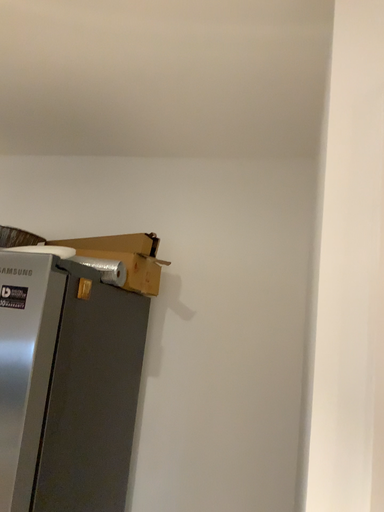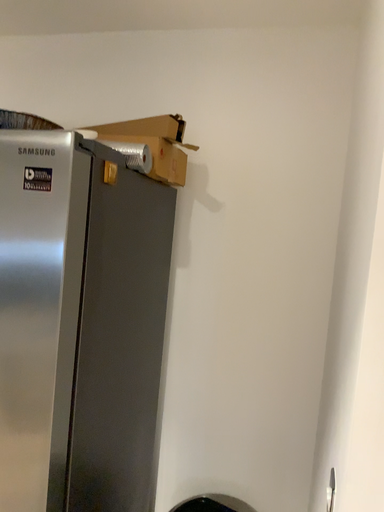
Question: Which way did the camera rotate in the video?

Choices:
 (A) rotated upward
 (B) rotated downward

Answer: (B)